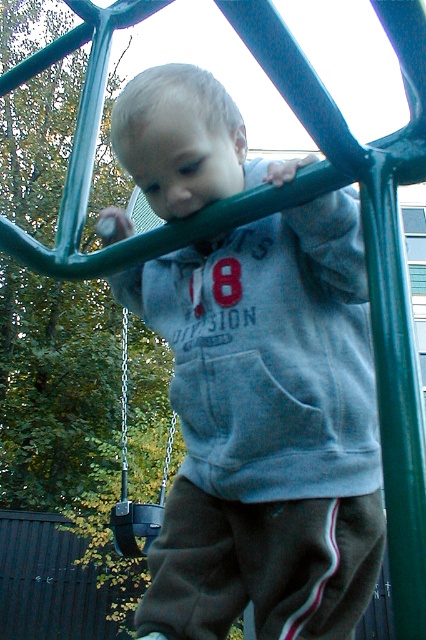
Question: Can you confirm if gray fleece sweatshirt at center is positioned to the left of black plastic swing at center?

Choices:
 (A) yes
 (B) no

Answer: (B)

Question: Which point is farther to the camera?

Choices:
 (A) (287, 422)
 (B) (169, 436)

Answer: (B)

Question: Is gray fleece sweatshirt at center closer to camera compared to black plastic swing at center?

Choices:
 (A) no
 (B) yes

Answer: (B)

Question: Is gray fleece sweatshirt at center thinner than black plastic swing at center?

Choices:
 (A) yes
 (B) no

Answer: (B)

Question: Which object appears closest to the camera in this image?

Choices:
 (A) gray fleece sweatshirt at center
 (B) black plastic swing at center

Answer: (A)